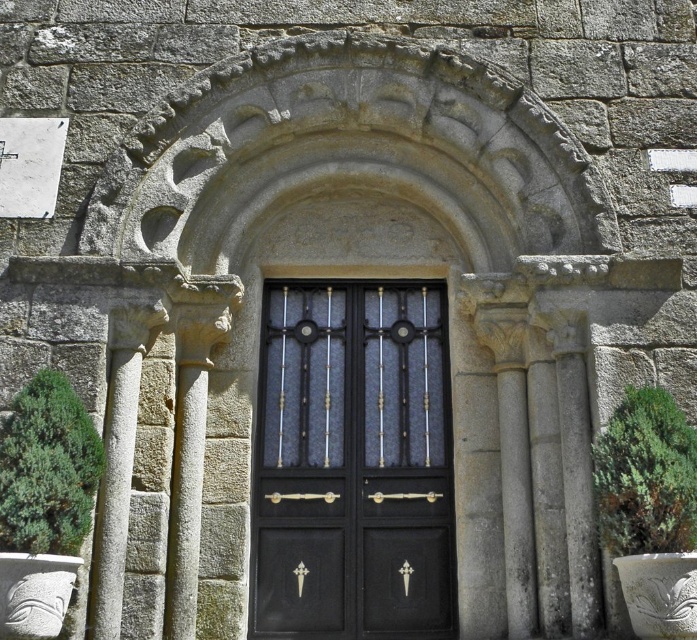
You are standing in front of the stone archway and want to place a decorative pot between the green leafy bush at left and the green leafy plant at right. Is there space between them to place the pot?

The green leafy bush at left is to the left of green leafy plant at right, so there is space between them to place the pot.

You are an architect examining the stone archway. You notice two points marked on the archway. The first point is at coordinate point (13, 451) and the second is at point (605, 454). Which point is nearer to you when you are standing in front of the archway?

Point (13, 451) is closer to the viewer than point (605, 454).